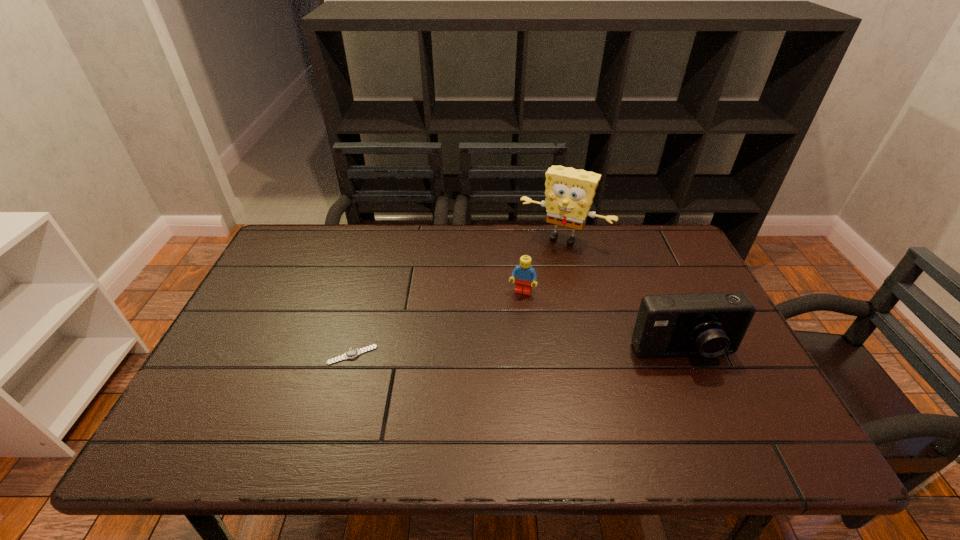
The width and height of the screenshot is (960, 540). In order to click on free spot on the desktop that is between the watch and the camera and is positioned on the face of the second farthest object in this screenshot , I will do `click(502, 354)`.

You are a GUI agent. You are given a task and a screenshot of the screen. Output one action in this format:
    pyautogui.click(x=<x>, y=<y>)
    Task: Click on the free spot on the desktop that is between the shortest object and the second tallest object and is positioned on the face of the farthest object
    Image resolution: width=960 pixels, height=540 pixels.
    Given the screenshot: What is the action you would take?
    pyautogui.click(x=506, y=354)